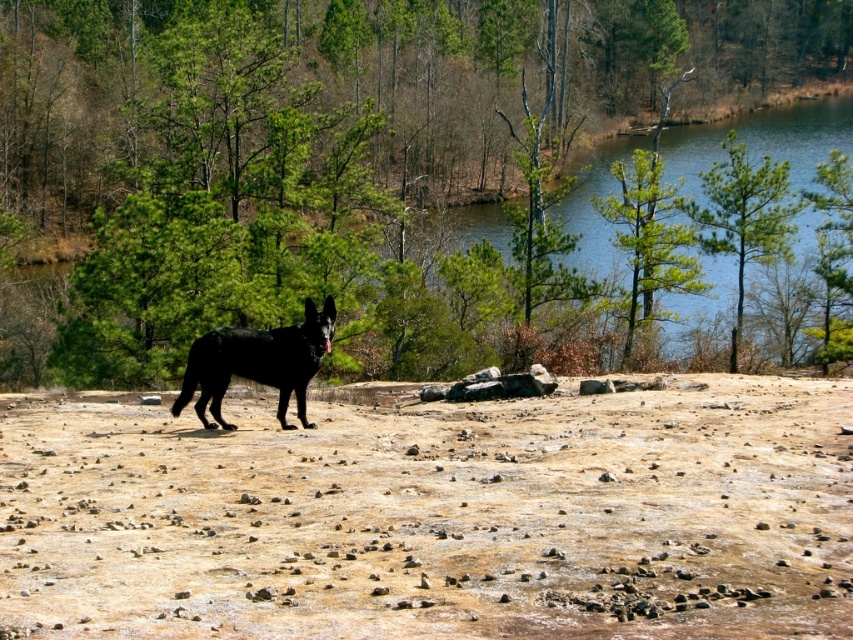
This screenshot has width=853, height=640. What do you see at coordinates (368, 166) in the screenshot?
I see `green leafy tree at center` at bounding box center [368, 166].

Identify the location of green leafy tree at center. The width and height of the screenshot is (853, 640). (368, 166).

Describe the element at coordinates (368, 166) in the screenshot. I see `green leafy tree at center` at that location.

Where is `green leafy tree at center`? Image resolution: width=853 pixels, height=640 pixels. green leafy tree at center is located at coordinates (368, 166).

Who is more forward, (744, 184) or (618, 170)?

Point (744, 184) is more forward.

Does green matte tree at upper right have a lesser height compared to green textured pine tree at upper center?

Yes, green matte tree at upper right is shorter than green textured pine tree at upper center.

Between point (737, 195) and point (646, 260), which one is positioned in front?

Point (737, 195) is in front.

At what (x,y) coordinates should I click in order to perform the action: click on green matte tree at upper right. Please return your answer as a coordinate pair (x, y). Looking at the image, I should click on coord(744,216).

Is green textured pine tree at upper center to the right of green leafy tree at upper right from the viewer's perspective?

No, green textured pine tree at upper center is not to the right of green leafy tree at upper right.

Is green textured pine tree at upper center behind green leafy tree at upper right?

Yes, it is.

The image size is (853, 640). What do you see at coordinates (648, 236) in the screenshot? I see `green textured pine tree at upper center` at bounding box center [648, 236].

Identify the location of green textured pine tree at upper center. (648, 236).